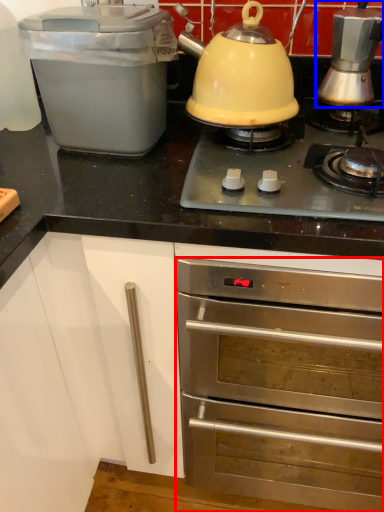
Question: Among these objects, which one is nearest to the camera, oven (highlighted by a red box) or kitchen appliance (highlighted by a blue box)?

Choices:
 (A) oven
 (B) kitchen appliance

Answer: (A)